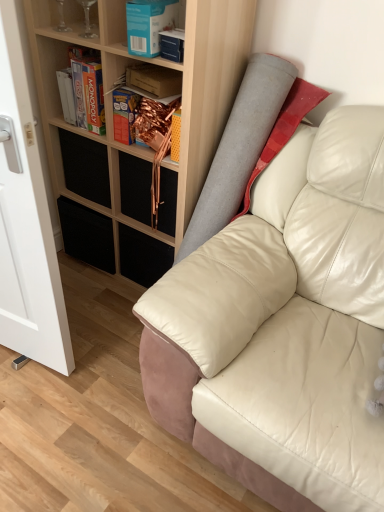
Question: Is blue cardboard box at upper center, which is the 1th book from front to back, inside the boundaries of wooden bookshelf at upper left, the 1th shelf positioned from the front, or outside?

Choices:
 (A) outside
 (B) inside

Answer: (B)

Question: Considering the positions of blue cardboard box at upper center, which is the 1th book from front to back, and wooden bookshelf at upper left, the second shelf when ordered from back to front, in the image, is blue cardboard box at upper center, which is the 1th book from front to back, wider or thinner than wooden bookshelf at upper left, the second shelf when ordered from back to front,?

Choices:
 (A) thin
 (B) wide

Answer: (A)

Question: Estimate the real-world distances between objects in this image. Which object is closer to the white glossy glass door at left?

Choices:
 (A) black matte drawer at upper left, which is counted as the 1th drawer, starting from the left
 (B) blue cardboard box at upper center, the 2th book from the back
 (C) matte cardboard box at upper center, which is counted as the 2th book, starting from the front
 (D) transparent glass wine glasses at upper left, marked as the 1th shelf in a left-to-right arrangement
 (E) white leather couch at center

Answer: (A)

Question: Estimate the real-world distances between objects in this image. Which object is closer to the metallic gold drawer at center, positioned as the first drawer in right-to-left order?

Choices:
 (A) blue cardboard box at upper center, the 2th book from the back
 (B) white leather couch at center
 (C) black matte drawer at upper left, which is counted as the 1th drawer, starting from the left
 (D) transparent glass wine glasses at upper left, which is the 2th shelf in bottom-to-top order
 (E) wooden bookshelf at upper left, which is counted as the 2th shelf, starting from the left

Answer: (E)